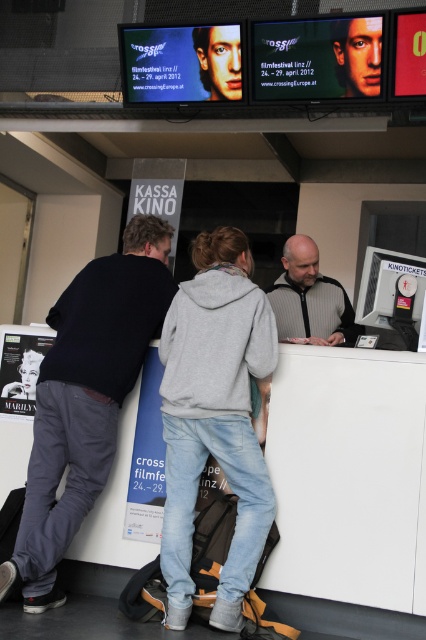
You are standing at the entrance of the ticket counter and want to take a photo of the gray hoodie at center without moving. Is the camera close enough to capture a clear photo?

The gray hoodie at center and camera are 8.26 feet apart, so the camera is close enough to capture a clear photo since 8.26 feet is a reasonable distance for most cameras to focus and capture clear images.

You are standing at the ticket counter and want to reach a point marked as point (230, 314) without moving your feet. Can you reach it with your outstretched hand?

The distance of point (230, 314) from viewer is 8.75 feet. Since the average human arm length is about 2.5 feet, you cannot reach it without moving your feet.